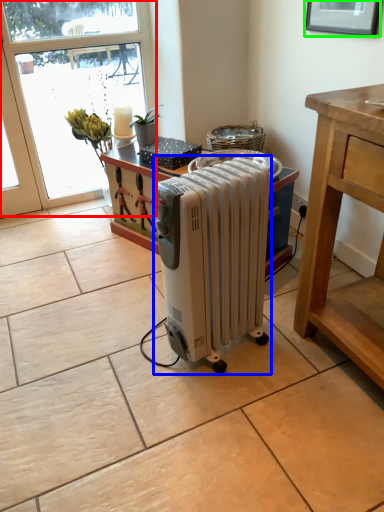
Question: Considering the real-world distances, which object is closest to window (highlighted by a red box)? home appliance (highlighted by a blue box) or picture frame (highlighted by a green box).

Choices:
 (A) home appliance
 (B) picture frame

Answer: (B)